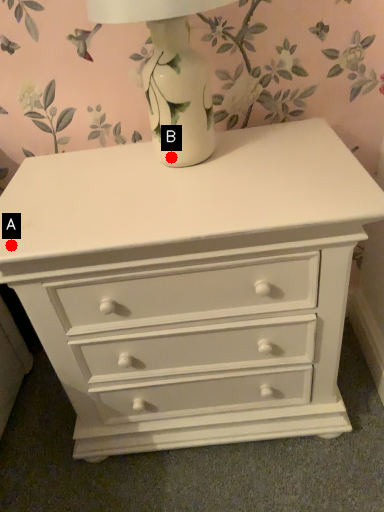
Question: Two points are circled on the image, labeled by A and B beside each circle. Which point is closer to the camera?

Choices:
 (A) A is closer
 (B) B is closer

Answer: (A)